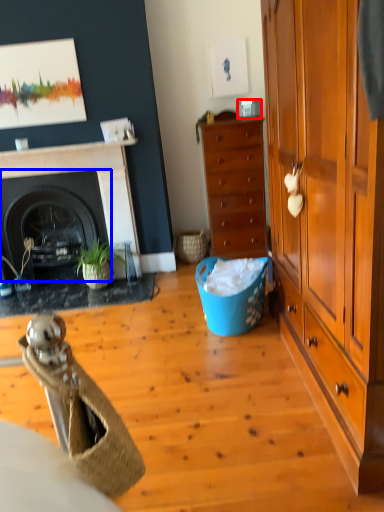
Question: Which object appears closest to the camera in this image, corded phone (highlighted by a red box) or fireplace (highlighted by a blue box)?

Choices:
 (A) corded phone
 (B) fireplace

Answer: (A)